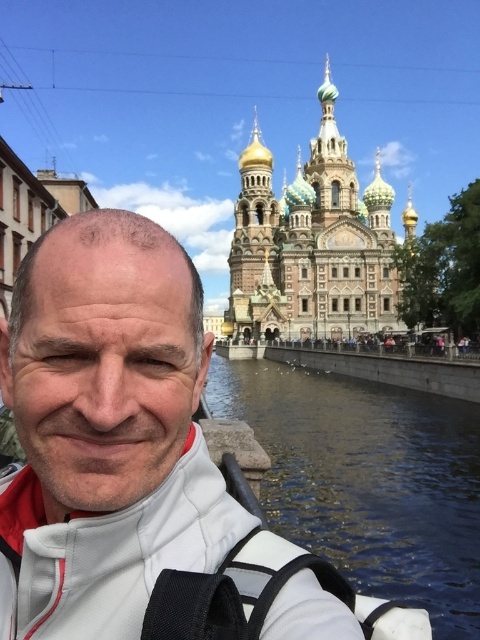
You are standing in front of the church with golden domes and want to take a photo of the dark blue water at center and the white quilted jacket at lower center. Which object should you focus on first to ensure both are in focus?

You should focus on the white quilted jacket at lower center first because it is closer to the viewer than the dark blue water at center. By focusing on the closer object, the farther object may still be within the depth of field.

You are a photographer trying to capture the golden domed cathedral at upper center in your shot. You notice the white quilted jacket at lower center is blocking part of the cathedral. Is the jacket above or below the cathedral?

The white quilted jacket at lower center is below the golden domed cathedral at upper center, so it is blocking the lower part of the cathedral.

You are standing at the point marked as point [369,481] in the image. What do you see directly in front of you?

You see dark blue water at center directly in front of you at point [369,481].